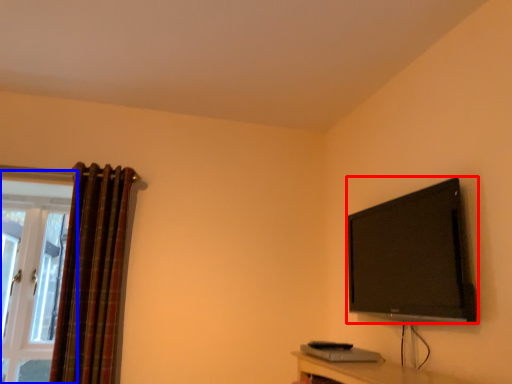
Question: Which of the following is the farthest to the observer, television (highlighted by a red box) or window (highlighted by a blue box)?

Choices:
 (A) television
 (B) window

Answer: (B)